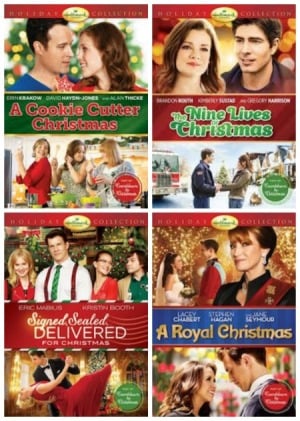
Find the location of a particular element. dvds is located at coordinates pyautogui.click(x=109, y=312), pyautogui.click(x=178, y=315), pyautogui.click(x=99, y=122), pyautogui.click(x=168, y=131).